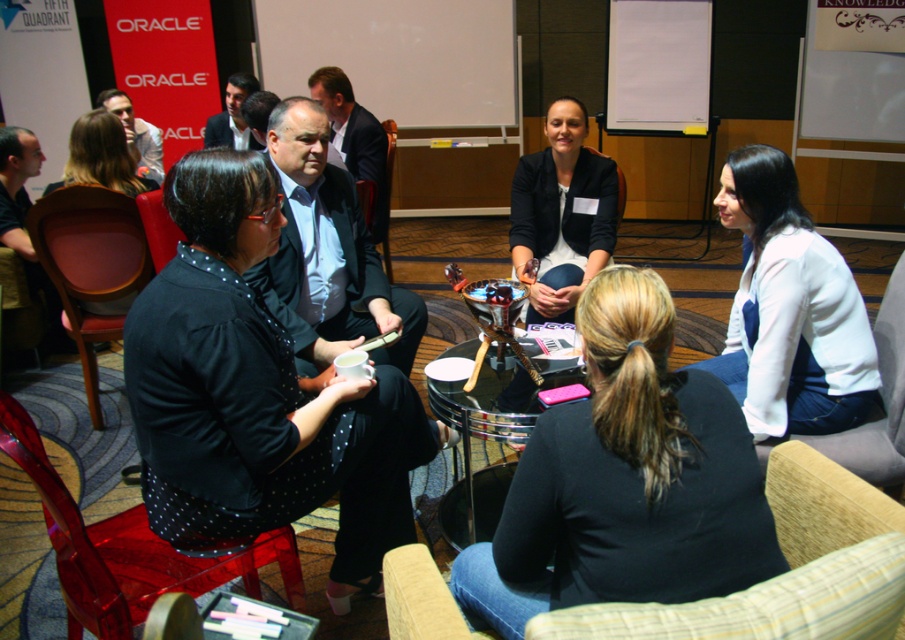
Is black dotted fabric at center thinner than white matte sweater at lower right?

No, black dotted fabric at center is not thinner than white matte sweater at lower right.

Is black dotted fabric at center shorter than white matte sweater at lower right?

No.

Is point (237, 467) closer to viewer compared to point (745, 237)?

That is True.

The width and height of the screenshot is (905, 640). I want to click on black dotted fabric at center, so click(258, 394).

Between black dotted fabric at center and transparent plastic armchair at left, which one is positioned lower?

black dotted fabric at center is lower down.

What do you see at coordinates (258, 394) in the screenshot?
I see `black dotted fabric at center` at bounding box center [258, 394].

Who is more forward, (137, 355) or (165, 259)?

Point (137, 355) is in front.

The image size is (905, 640). I want to click on black dotted fabric at center, so click(x=258, y=394).

Consider the image. Who is positioned more to the left, dark suit at center or transparent plastic armchair at lower left?

From the viewer's perspective, transparent plastic armchair at lower left appears more on the left side.

Can you confirm if dark suit at center is bigger than transparent plastic armchair at lower left?

Indeed, dark suit at center has a larger size compared to transparent plastic armchair at lower left.

Describe the element at coordinates (327, 253) in the screenshot. I see `dark suit at center` at that location.

Locate an element on the screen. dark suit at center is located at coordinates (327, 253).